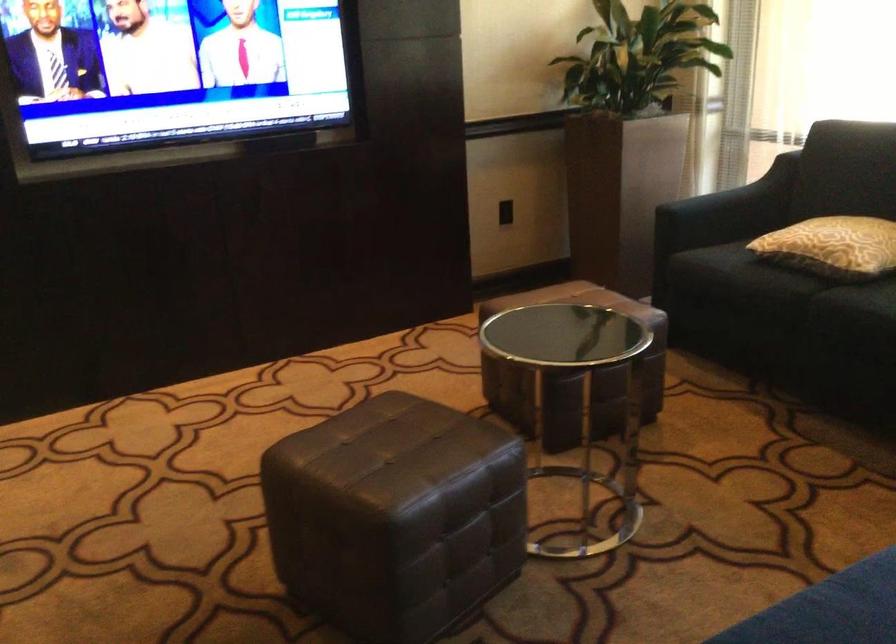
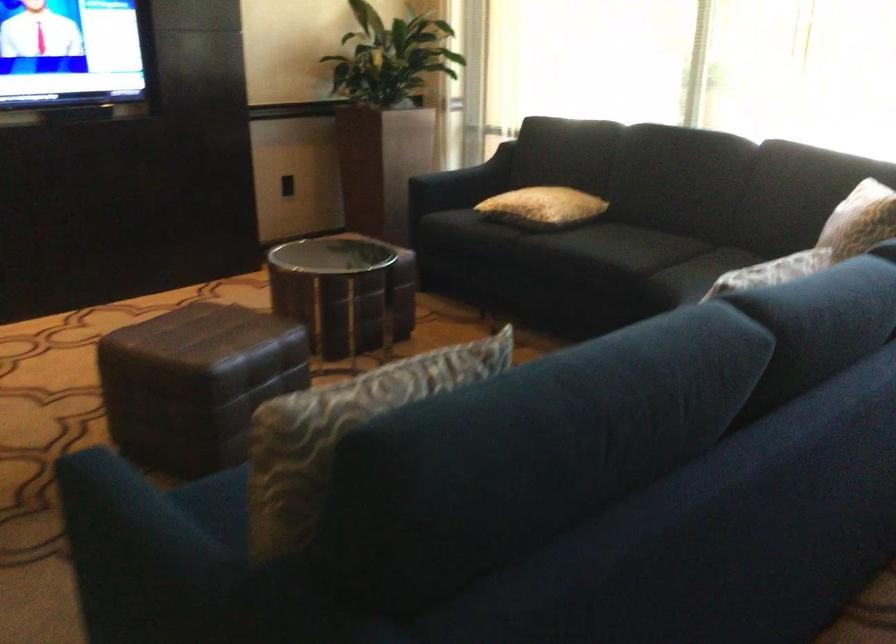
Find the pixel in the second image that matches point (366, 534) in the first image.

(195, 383)